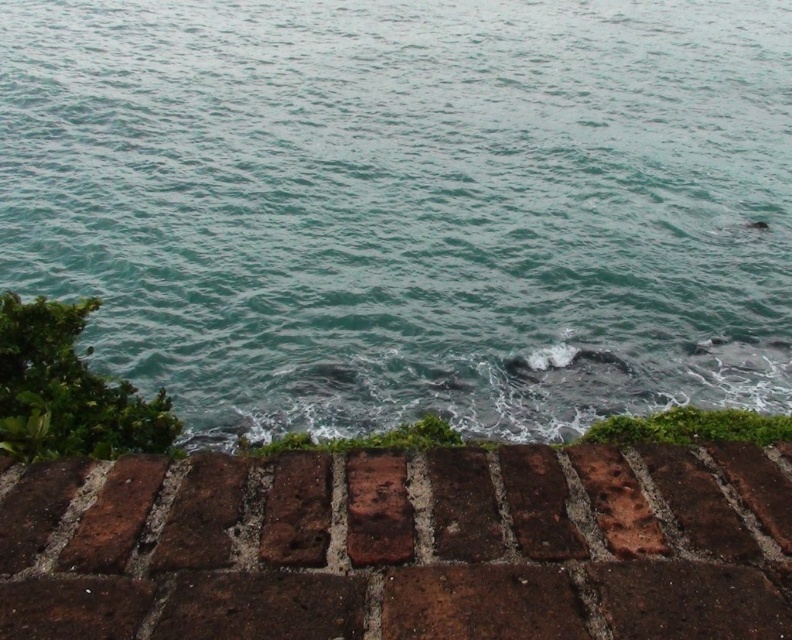
Consider the image. Does teal water at center appear under brown brick wall at lower center?

No, teal water at center is not below brown brick wall at lower center.

Is teal water at center shorter than brown brick wall at lower center?

Incorrect, teal water at center's height does not fall short of brown brick wall at lower center's.

I want to click on teal water at center, so click(408, 205).

Locate an element on the screen. The image size is (792, 640). teal water at center is located at coordinates (408, 205).